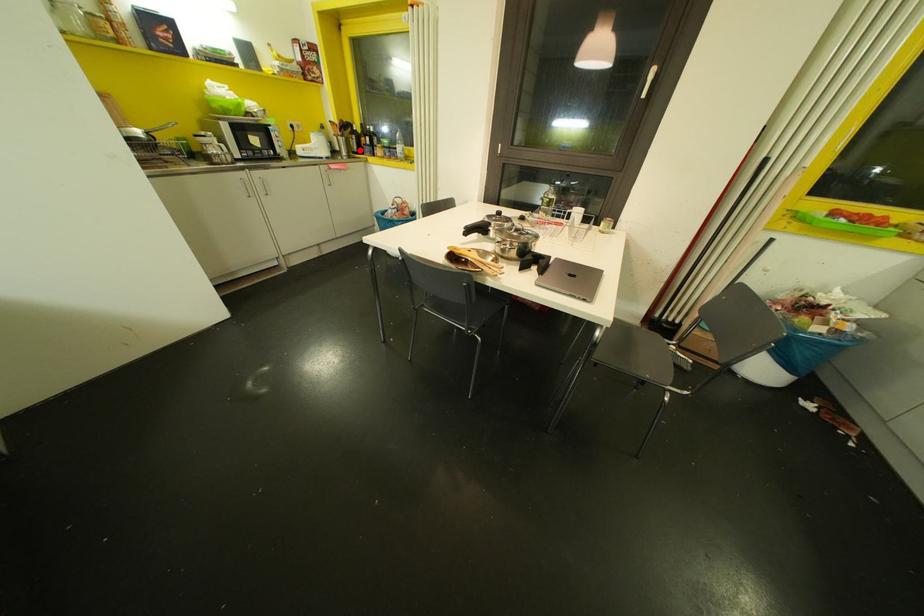
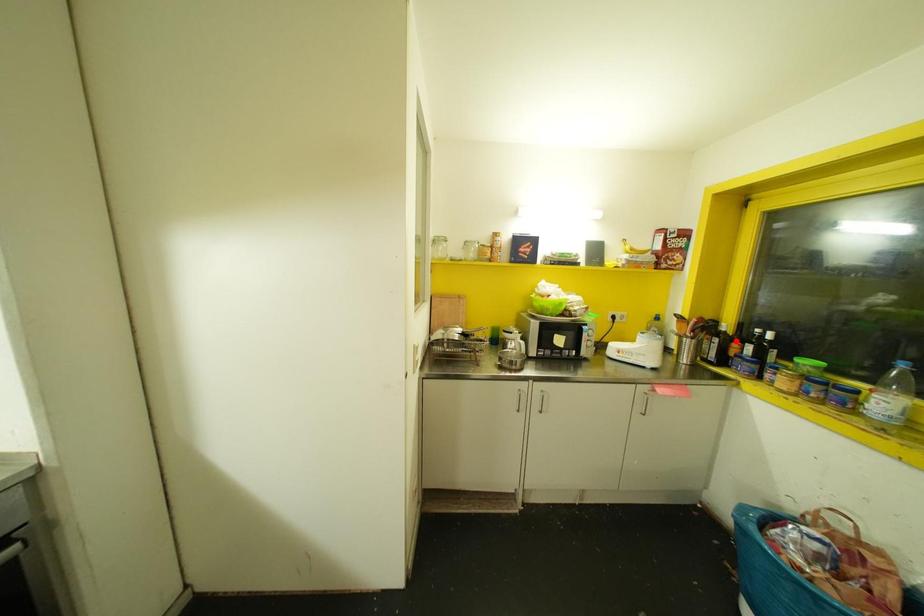
I am providing you with two images of the same scene from different viewpoints. A red point is marked on the first image and another point is marked on the second image. Do the highlighted points in image1 and image2 indicate the same real-world spot?

No